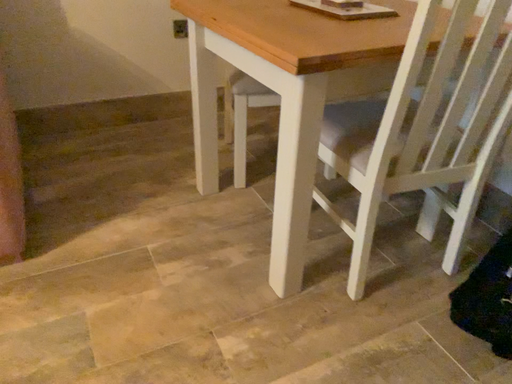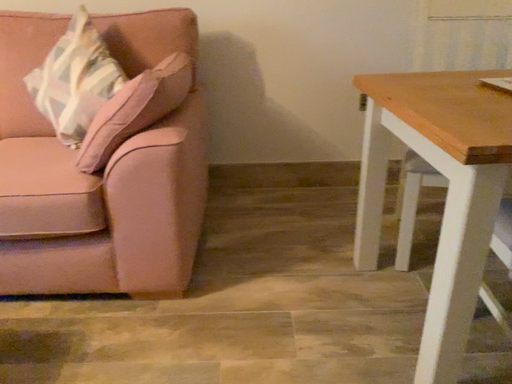
Question: How did the camera likely rotate when shooting the video?

Choices:
 (A) rotated upward
 (B) rotated downward

Answer: (A)